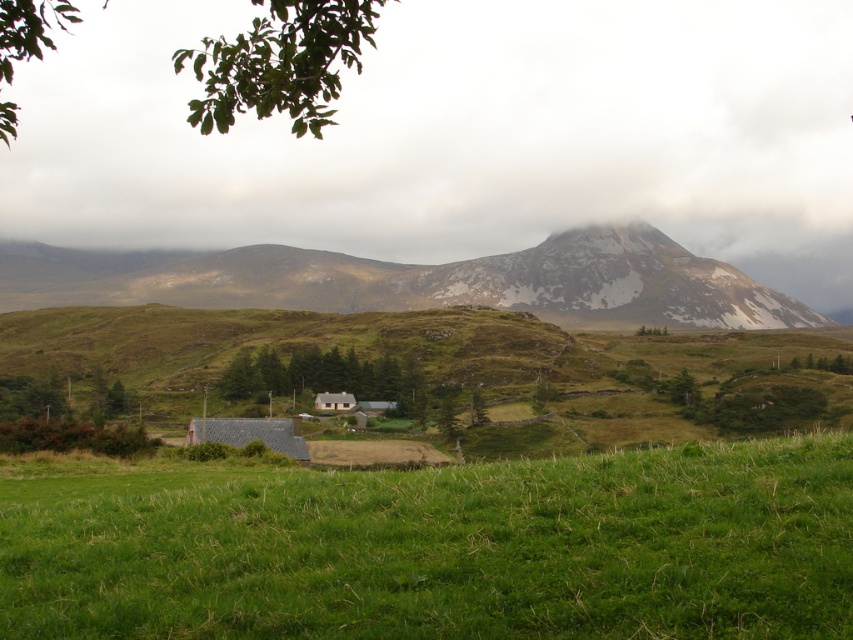
You are a drone operator trying to capture aerial footage of the gray slate roof at lower center and the wooden cabin at center. Your drone has a camera with a 10m wide field of view. Can you fit both objects into a single frame without moving the drone?

The gray slate roof at lower center is wider than the wooden cabin at center. Since the drone camera has a 10m wide field of view, you need to check if the combined width of both objects is within 10m. However, the exact dimensions of each object are not provided, so it depends on their actual sizes. If their total width is less than or equal to 10m, they can fit. If not, they cannot.

You are standing at the point labeled point (437, 547) in the image. What type of terrain are you currently standing on?

The point labeled point (437, 547) is located on the green grassy field at center, so you are standing on a grassy terrain.